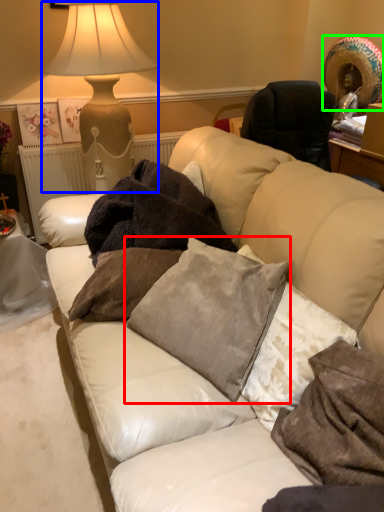
Question: Which is nearer to the pillow (highlighted by a red box)? table lamp (highlighted by a blue box) or straw hat (highlighted by a green box).

Choices:
 (A) table lamp
 (B) straw hat

Answer: (A)